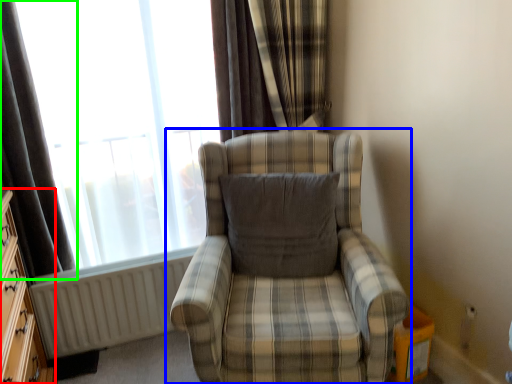
Question: Estimate the real-world distances between objects in this image. Which object is closer to dresser (highlighted by a red box), chair (highlighted by a blue box) or curtain (highlighted by a green box)?

Choices:
 (A) chair
 (B) curtain

Answer: (B)